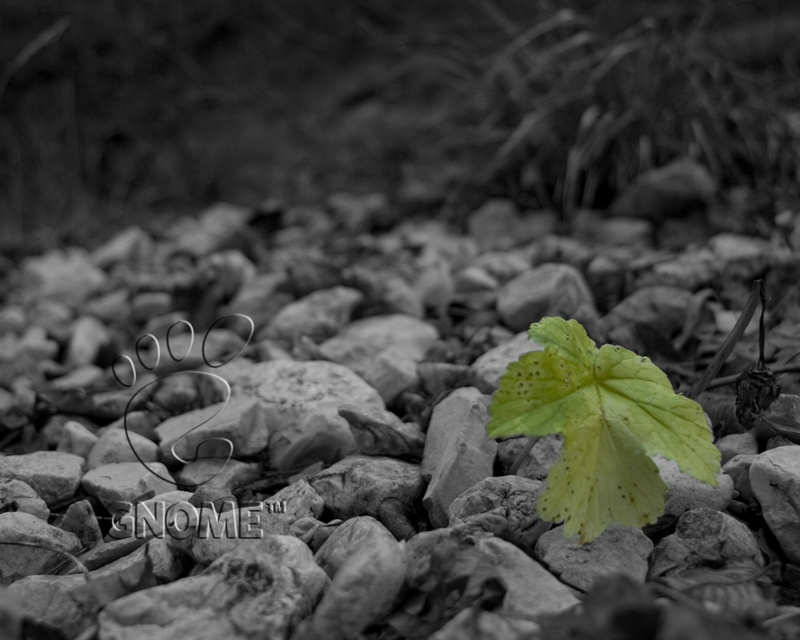
Question: Can you confirm if smooth gray rock at center is positioned to the left of green matte leaf at center?

Choices:
 (A) no
 (B) yes

Answer: (B)

Question: Among these objects, which one is nearest to the camera?

Choices:
 (A) green matte leaf at center
 (B) smooth gray rock at center

Answer: (B)

Question: Can you confirm if smooth gray rock at center is smaller than green matte leaf at center?

Choices:
 (A) yes
 (B) no

Answer: (B)

Question: Which object is closer to the camera taking this photo?

Choices:
 (A) green matte leaf at center
 (B) smooth gray rock at center

Answer: (B)

Question: Is smooth gray rock at center smaller than green matte leaf at center?

Choices:
 (A) no
 (B) yes

Answer: (A)